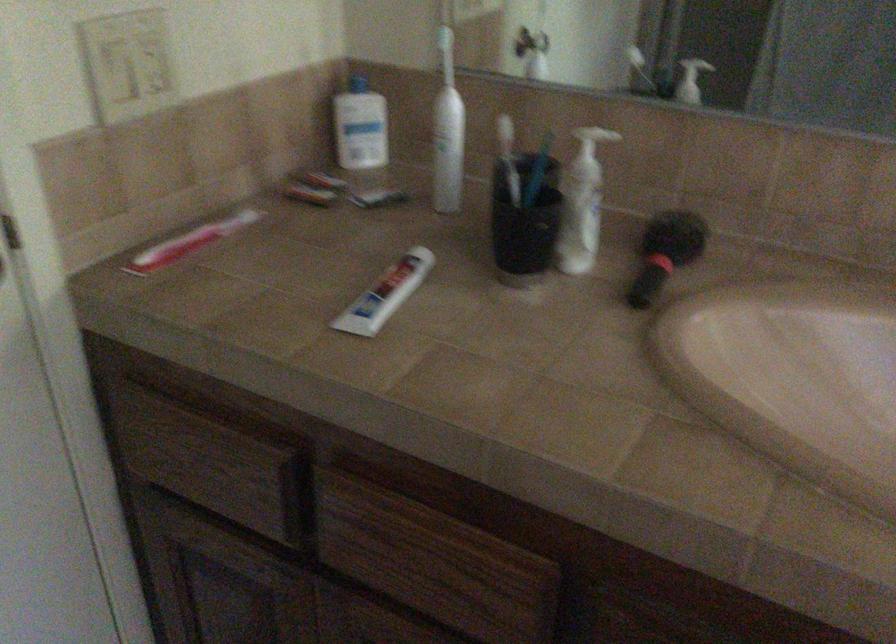
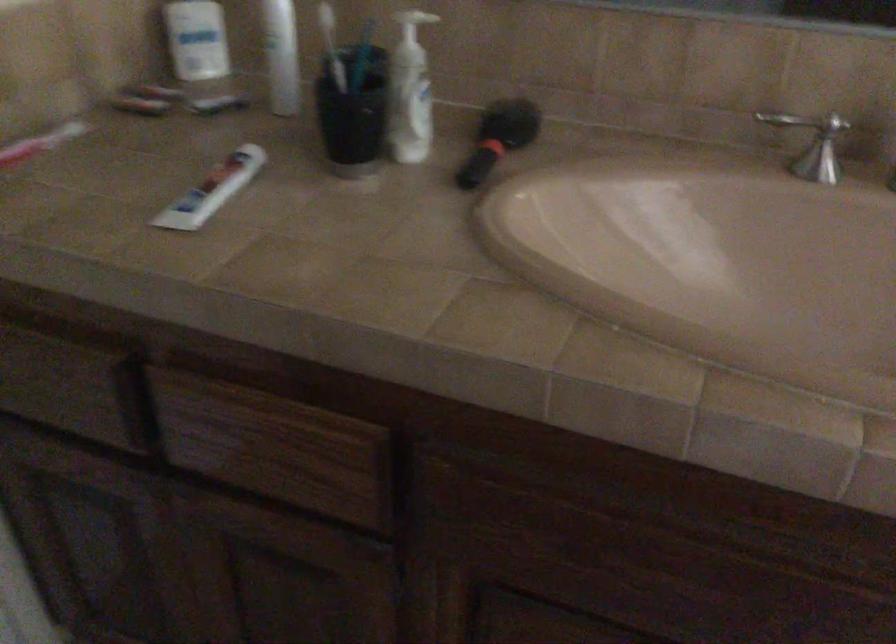
Find the pixel in the second image that matches (236,474) in the first image.

(74, 388)